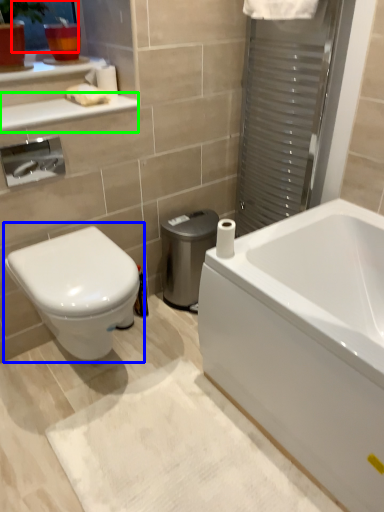
Question: Which is farther away from window screen (highlighted by a red box)? toilet (highlighted by a blue box) or balustrade (highlighted by a green box)?

Choices:
 (A) toilet
 (B) balustrade

Answer: (A)